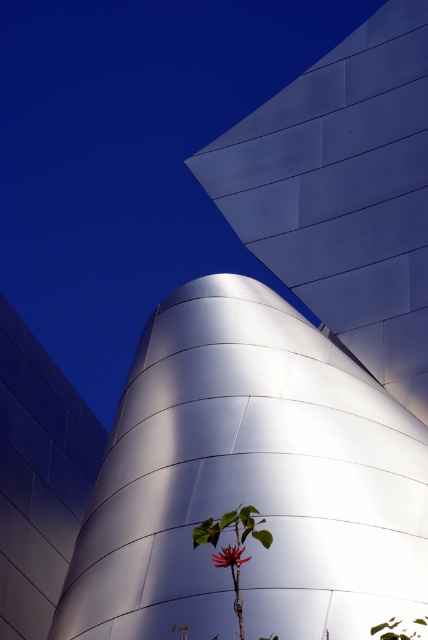
You are a gardener who needs to water both the green leafy plant at lower center and the bright red flower at center. Your watering can holds enough water for 6 feet of travel. Can you water both without refilling?

The distance between the green leafy plant at lower center and the bright red flower at center is 5.93 feet, which is just under 6 feet. Therefore, you can water both without needing to refill your watering can.

You are a landscape architect designing a garden. You need to place a decorative stone between the green leafy plant at lower center and the bright red flower at center. Based on their widths, which object should the stone be closer to?

The green leafy plant at lower center might be wider than bright red flower at center, so the decorative stone should be placed closer to the bright red flower at center to ensure proper spacing between the two plants.

You are a landscape architect designing a garden that incorporates both natural elements and modern structures. You have a green leafy plant at lower center and a bright red flower at center. Which element should you choose if you want to highlight a larger natural feature in your design?

The green leafy plant at lower center is bigger than the bright red flower at center, so you should choose the green leafy plant at lower center to highlight a larger natural feature in your design.